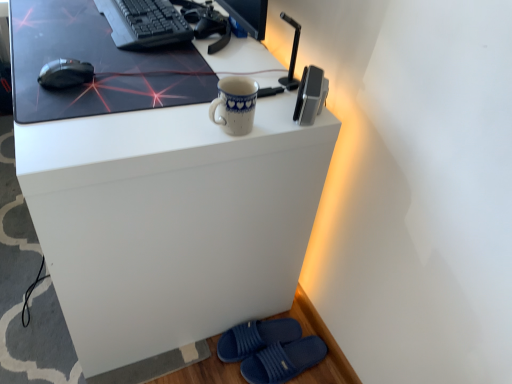
Locate an element on the screen. This screenshot has height=384, width=512. vacant space situated on the left part of satin silver speaker at upper right is located at coordinates (254, 101).